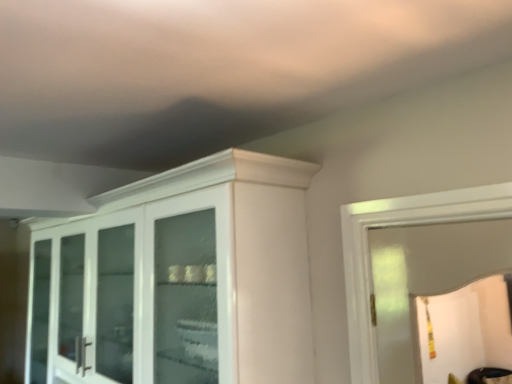
Question: Should I look upward or downward to see white glossy cabinet at upper left?

Choices:
 (A) up
 (B) down

Answer: (B)